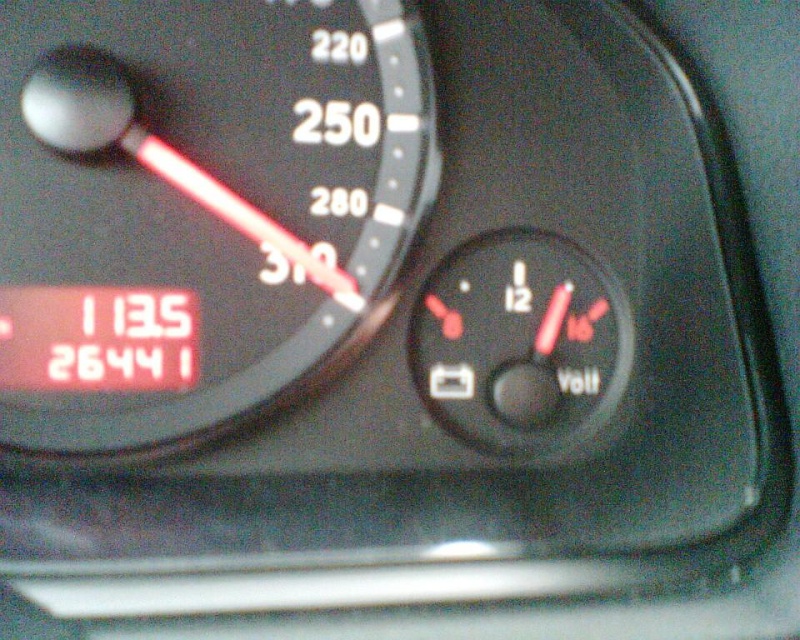
In the scene shown: You are driving a car and need to check both the black plastic speedometer at upper left and the black plastic voltmeter at center. Which one do you look at first if you want to monitor your current speed?

The black plastic speedometer at upper left is to the left of the black plastic voltmeter at center. Since the speedometer is on the left, you would look at the black plastic speedometer at upper left first to monitor your current speed.

You are a delivery driver who needs to check both the speedometer and the digital display on the car dashboard. If your hand is currently resting on the point at (342,99), can you reach both without moving your hand more than 1.30 meters?

Yes, because the distance between the speedometer and the digital display is exactly 1.30 meters, so you can reach both without moving your hand more than that distance.

You are a mechanic inspecting the car dashboard. You need to check both the black plastic speedometer at upper left and the black plastic voltmeter at center. Which one do you need to reach higher to inspect?

The black plastic speedometer at upper left has a greater height compared to the black plastic voltmeter at center, so you need to reach higher to inspect the black plastic speedometer at upper left.